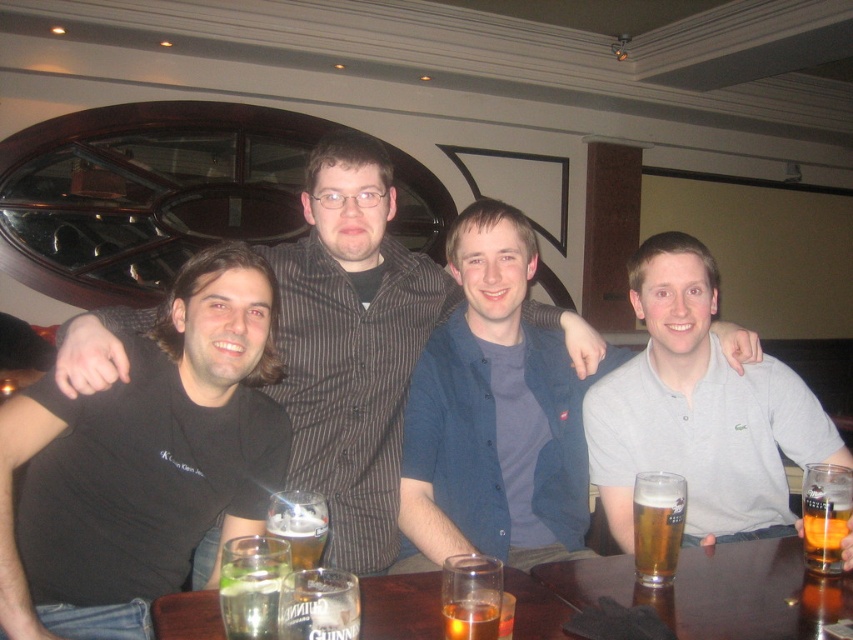
Is black t-shirt at center to the left of gray polo shirt at center from the viewer's perspective?

Indeed, black t-shirt at center is positioned on the left side of gray polo shirt at center.

Where is `black t-shirt at center`? The width and height of the screenshot is (853, 640). black t-shirt at center is located at coordinates (144, 454).

Can you confirm if blue cotton shirt at center is wider than translucent glass table at center?

In fact, blue cotton shirt at center might be narrower than translucent glass table at center.

From the picture: Is blue cotton shirt at center behind translucent glass table at center?

That is True.

Between point (453, 436) and point (161, 600), which one is positioned behind?

Positioned behind is point (453, 436).

At what (x,y) coordinates should I click in order to perform the action: click on blue cotton shirt at center. Please return your answer as a coordinate pair (x, y). Looking at the image, I should click on (492, 412).

Does black t-shirt at center have a greater width compared to golden glass beer at center?

Indeed, black t-shirt at center has a greater width compared to golden glass beer at center.

Is black t-shirt at center shorter than golden glass beer at center?

Incorrect, black t-shirt at center's height does not fall short of golden glass beer at center's.

In the scene shown: Who is more forward, [117,404] or [637,566]?

Point [637,566] is more forward.

Where is `black t-shirt at center`? Image resolution: width=853 pixels, height=640 pixels. black t-shirt at center is located at coordinates (144, 454).